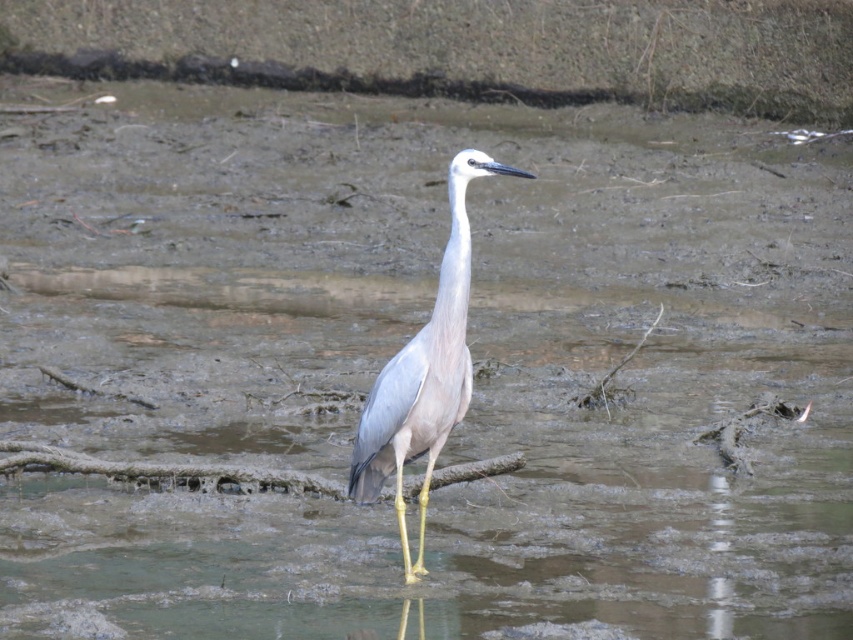
Is white matte bird at center positioned before white smooth neck at center?

That is True.

Can you confirm if white matte bird at center is positioned above white smooth neck at center?

Actually, white matte bird at center is below white smooth neck at center.

The image size is (853, 640). What do you see at coordinates (424, 372) in the screenshot? I see `white matte bird at center` at bounding box center [424, 372].

Locate an element on the screen. white matte bird at center is located at coordinates (424, 372).